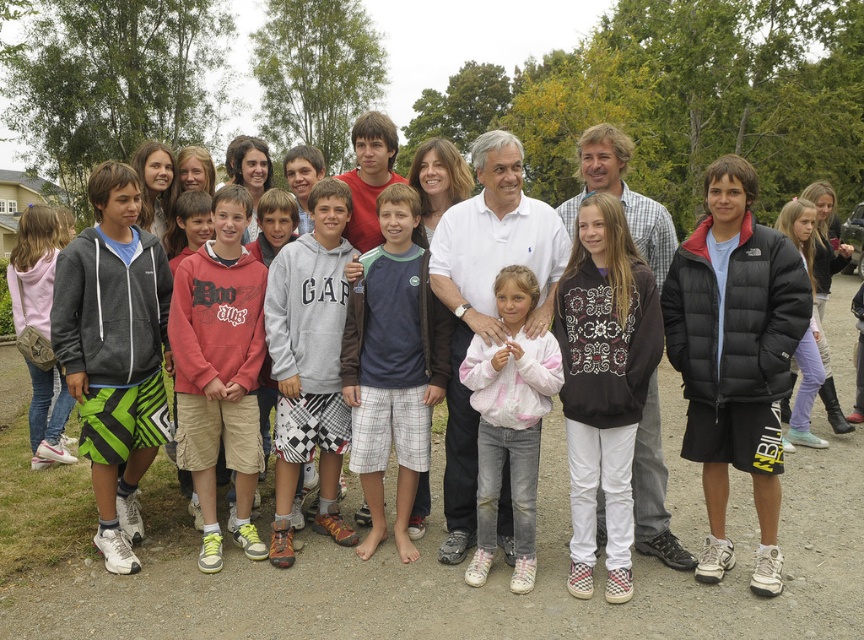
Looking at this image, is dark blue cotton shirt at center to the right of white cotton polo shirt at center from the viewer's perspective?

Incorrect, dark blue cotton shirt at center is not on the right side of white cotton polo shirt at center.

Is dark blue cotton shirt at center shorter than white cotton polo shirt at center?

No.

Image resolution: width=864 pixels, height=640 pixels. What do you see at coordinates (392, 364) in the screenshot? I see `dark blue cotton shirt at center` at bounding box center [392, 364].

Find the location of `dark blue cotton shirt at center`. dark blue cotton shirt at center is located at coordinates (392, 364).

Can you confirm if red hoodie at center is taller than dark blue cotton shirt at center?

Correct, red hoodie at center is much taller as dark blue cotton shirt at center.

Is red hoodie at center positioned at the back of dark blue cotton shirt at center?

No, it is not.

I want to click on red hoodie at center, so point(219,369).

The width and height of the screenshot is (864, 640). What are the coordinates of `red hoodie at center` in the screenshot? It's located at (219, 369).

Does green and black shorts at left have a larger size compared to gray cotton hoodie at center?

Yes.

In the scene shown: Is green and black shorts at left smaller than gray cotton hoodie at center?

No.

Where is `green and black shorts at left`? This screenshot has width=864, height=640. green and black shorts at left is located at coordinates (113, 352).